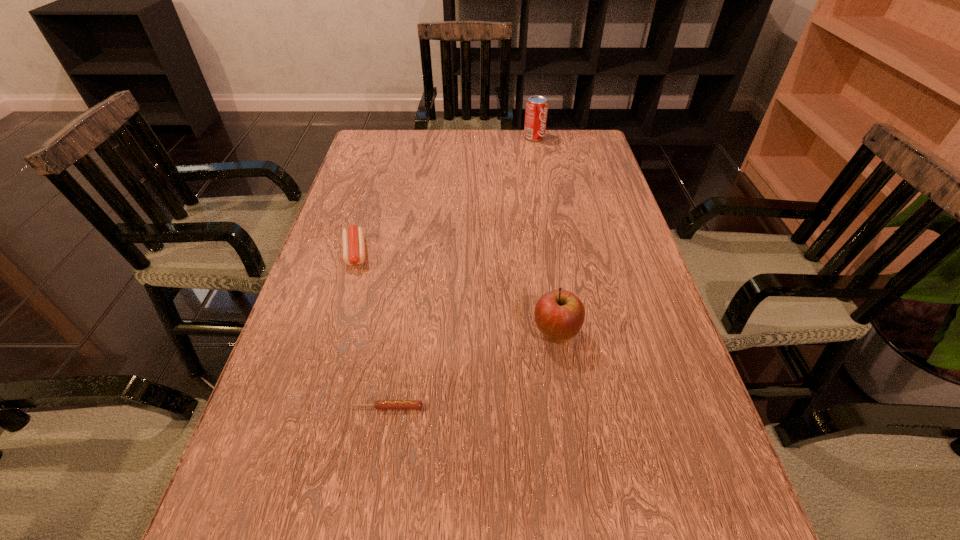
This screenshot has height=540, width=960. Find the location of `the farthest object`. the farthest object is located at coordinates (536, 112).

Identify the location of apple. (559, 314).

Locate an element on the screen. This screenshot has height=540, width=960. the leftmost object is located at coordinates (353, 240).

I want to click on the third tallest object, so click(x=353, y=240).

You are a GUI agent. You are given a task and a screenshot of the screen. Output one action in this format:
    pyautogui.click(x=<x>, y=<y>)
    Task: Click on the nearest object
    Image resolution: width=960 pixels, height=540 pixels.
    Given the screenshot: What is the action you would take?
    pyautogui.click(x=380, y=404)

Locate an element on the screen. This screenshot has height=540, width=960. the second object from left to right is located at coordinates (380, 404).

Locate an element on the screen. vacant point located on the front of the farthest object is located at coordinates (540, 171).

Where is `vacant space situated 0.400m on the left of the apple`? This screenshot has width=960, height=540. vacant space situated 0.400m on the left of the apple is located at coordinates (327, 334).

Where is `free space located on the front of the taller sausage`? Image resolution: width=960 pixels, height=540 pixels. free space located on the front of the taller sausage is located at coordinates (313, 396).

You are a GUI agent. You are given a task and a screenshot of the screen. Output one action in this format:
    pyautogui.click(x=<x>, y=<y>)
    Task: Click on the free region located on the right of the nearest object
    
    Given the screenshot: What is the action you would take?
    pyautogui.click(x=623, y=407)